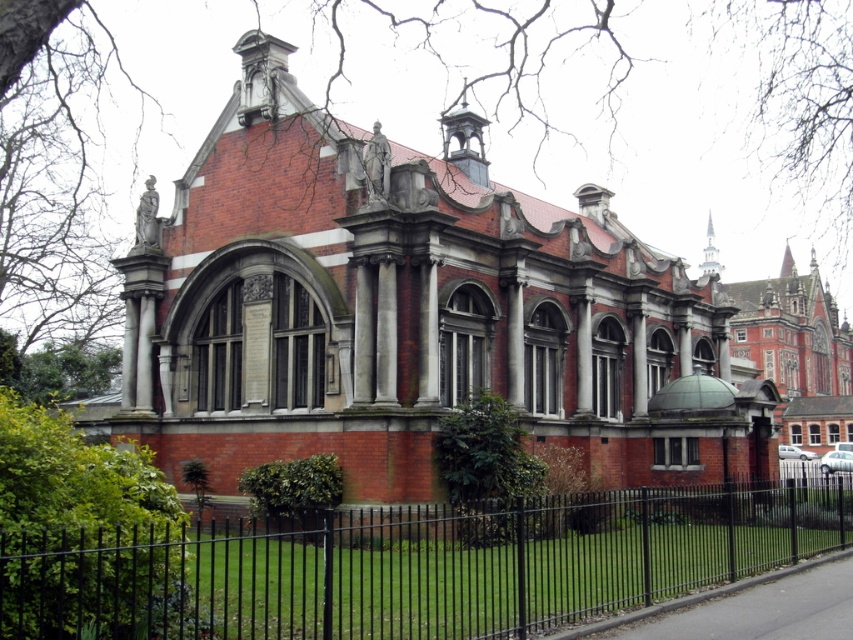
Which is more to the left, red brick church at center or black metal fence at lower center?

black metal fence at lower center

From the picture: Is red brick church at center above black metal fence at lower center?

Correct, red brick church at center is located above black metal fence at lower center.

Where is `red brick church at center`? This screenshot has width=853, height=640. red brick church at center is located at coordinates (409, 310).

Where is `red brick church at center`? red brick church at center is located at coordinates (409, 310).